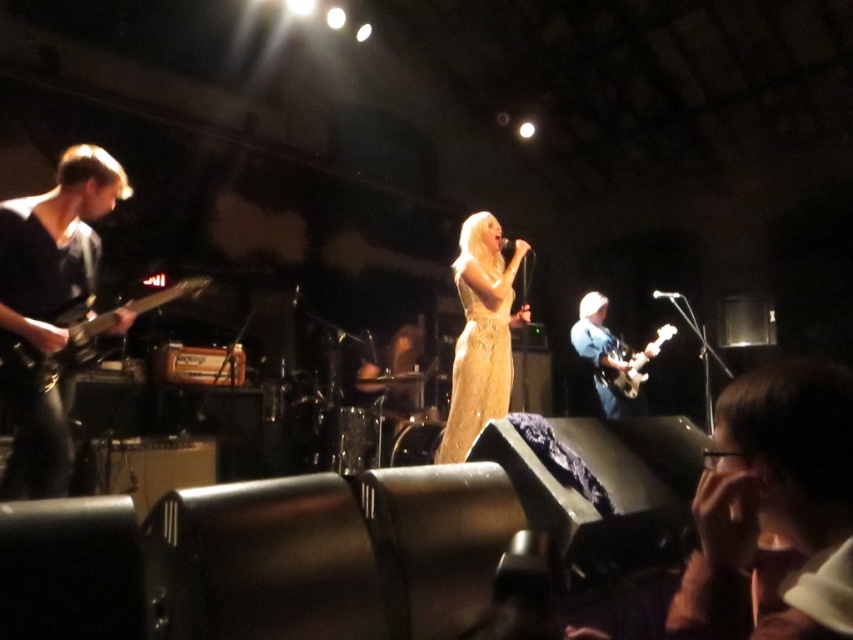
Question: Which point is farther from the camera taking this photo?

Choices:
 (A) (503, 358)
 (B) (54, 358)
 (C) (596, 380)
 (D) (19, 220)

Answer: (C)

Question: Which of the following is the farthest from the observer?

Choices:
 (A) (39, 397)
 (B) (634, 413)
 (C) (526, 246)

Answer: (B)

Question: Which point is farther to the camera?

Choices:
 (A) black matte guitar at left
 (B) shiny silver guitar at center
 (C) shiny black electric guitar at left
 (D) gold shimmering dress at center

Answer: (B)

Question: Is shiny black electric guitar at left further to camera compared to shiny silver guitar at center?

Choices:
 (A) yes
 (B) no

Answer: (B)

Question: Is gold shimmering dress at center wider than shiny silver guitar at center?

Choices:
 (A) no
 (B) yes

Answer: (A)

Question: Does gold shimmering dress at center have a smaller size compared to shiny silver guitar at center?

Choices:
 (A) no
 (B) yes

Answer: (A)